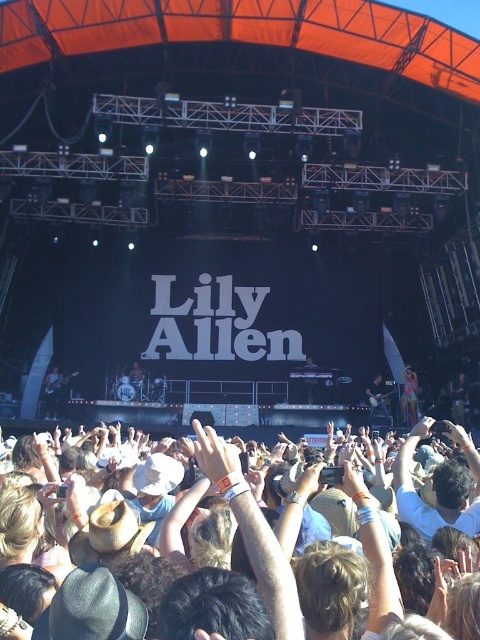
Does white cloth hands at center have a lesser height compared to shiny black guitar at center?

No.

Between point (343, 451) and point (381, 396), which one is positioned behind?

Positioned behind is point (381, 396).

Does point (358, 492) come in front of point (385, 392)?

Yes, it is in front of point (385, 392).

The width and height of the screenshot is (480, 640). Find the location of `white cloth hands at center`. white cloth hands at center is located at coordinates (252, 532).

Does white cloth hands at center have a lesser height compared to pink fabric dress at center?

No, white cloth hands at center is not shorter than pink fabric dress at center.

Is white cloth hands at center below pink fabric dress at center?

Yes, white cloth hands at center is below pink fabric dress at center.

This screenshot has height=640, width=480. What do you see at coordinates (252, 532) in the screenshot? I see `white cloth hands at center` at bounding box center [252, 532].

You are a GUI agent. You are given a task and a screenshot of the screen. Output one action in this format:
    pyautogui.click(x=<x>, y=<y>)
    Task: Click on the white cloth hands at center
    The image size is (480, 640).
    Given the screenshot: What is the action you would take?
    pyautogui.click(x=252, y=532)

Is pink fabric dress at center wider than shiny black guitar at center?

No, pink fabric dress at center is not wider than shiny black guitar at center.

Who is positioned more to the right, pink fabric dress at center or shiny black guitar at center?

Positioned to the right is pink fabric dress at center.

Is point (403, 419) positioned behind point (374, 385)?

No, it is in front of (374, 385).

This screenshot has width=480, height=640. Find the location of `pink fabric dress at center`. pink fabric dress at center is located at coordinates (408, 396).